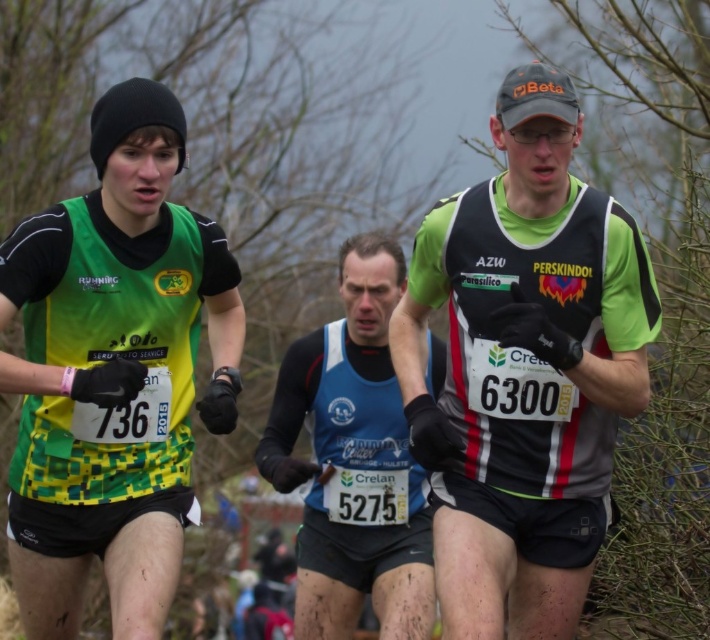
Can you confirm if green jersey at center is positioned above green/yellow mesh vest at left?

Yes, green jersey at center is above green/yellow mesh vest at left.

Can you confirm if green jersey at center is positioned to the left of green/yellow mesh vest at left?

No, green jersey at center is not to the left of green/yellow mesh vest at left.

Describe the element at coordinates (524, 368) in the screenshot. I see `green jersey at center` at that location.

Locate an element on the screen. green jersey at center is located at coordinates [x=524, y=368].

Who is lower down, green/yellow mesh vest at left or blue fabric running vest at center?

blue fabric running vest at center is lower down.

Is green/yellow mesh vest at left to the left of blue fabric running vest at center from the viewer's perspective?

Yes, green/yellow mesh vest at left is to the left of blue fabric running vest at center.

Where is `green/yellow mesh vest at left`? green/yellow mesh vest at left is located at coordinates (114, 365).

Identify the location of green/yellow mesh vest at left. The image size is (710, 640). (114, 365).

Between point (426, 440) and point (310, 628), which one is positioned behind?

The point (310, 628) is more distant.

Looking at this image, measure the distance between green jersey at center and camera.

green jersey at center and camera are 4.33 meters apart.

What do you see at coordinates (524, 368) in the screenshot? I see `green jersey at center` at bounding box center [524, 368].

Find the location of a particular element. Image resolution: width=710 pixels, height=640 pixels. green jersey at center is located at coordinates (524, 368).